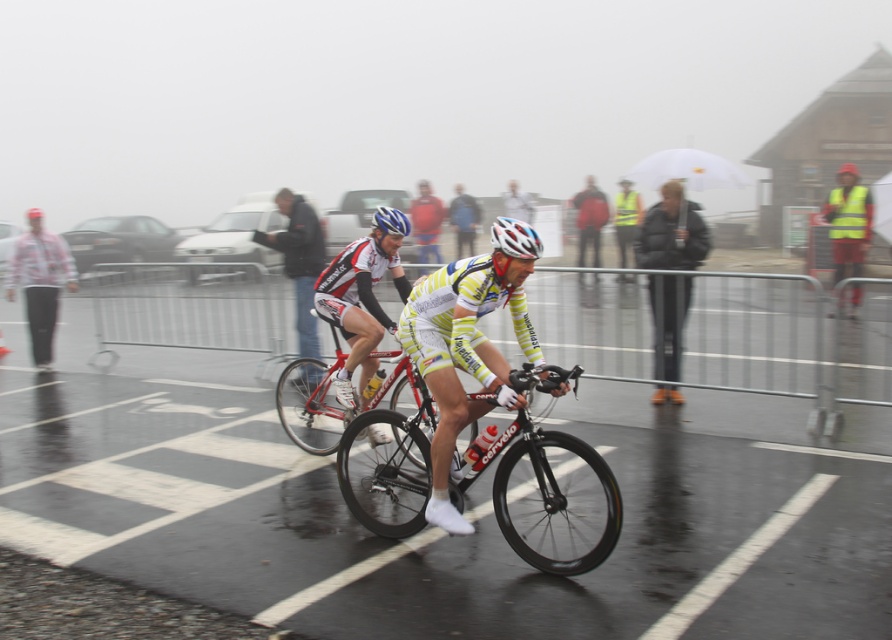
You are a photographer positioned at the starting line of the cycling event. You want to capture a photo of both the dark gray jacket at center and the white matte bicycle helmet at center in the same frame. Based on their positions, which object should you adjust your camera to focus on first to ensure both are in the shot?

The dark gray jacket at center is to the left of white matte bicycle helmet at center, so you should focus on the white matte bicycle helmet at center first to ensure both are captured in the frame.